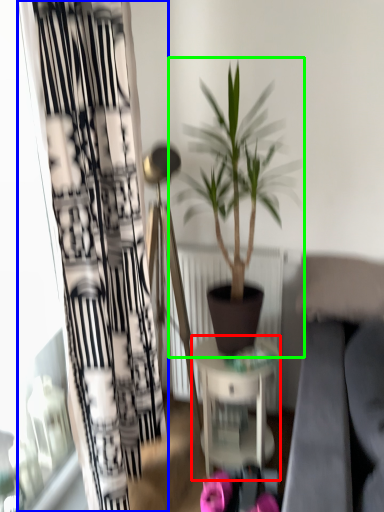
Question: Considering the real-world distances, which object is farthest from table (highlighted by a red box)? curtain (highlighted by a blue box) or houseplant (highlighted by a green box)?

Choices:
 (A) curtain
 (B) houseplant

Answer: (A)